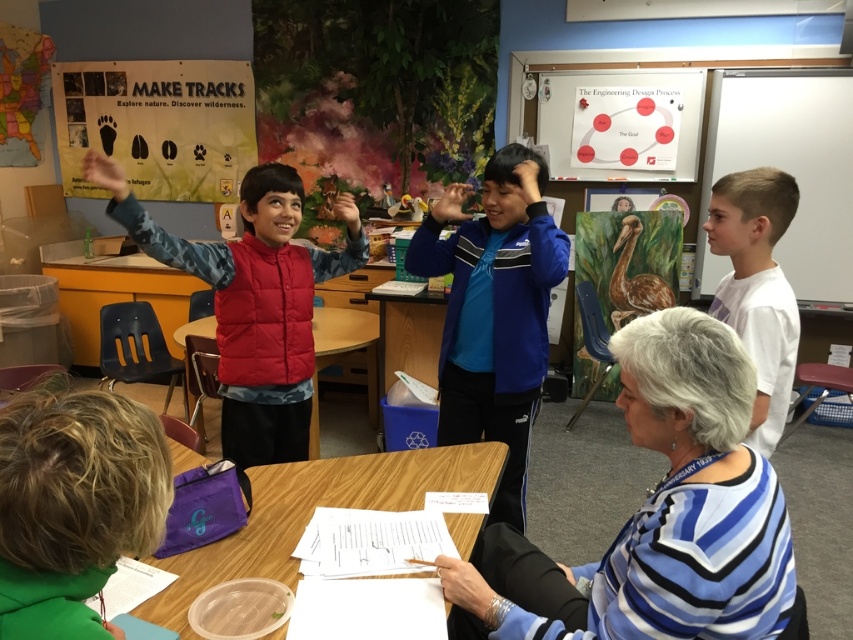
Is purple fabric table at lower center taller than smooth skin hand at center?

Yes, purple fabric table at lower center is taller than smooth skin hand at center.

Does purple fabric table at lower center appear over smooth skin hand at center?

Correct, purple fabric table at lower center is located above smooth skin hand at center.

Which is in front, point (306, 477) or point (439, 556)?

Point (439, 556) is in front.

This screenshot has height=640, width=853. In order to click on purple fabric table at lower center in this screenshot , I will do tap(311, 513).

Which is more to the left, green fabric at lower left or wooden table at center?

wooden table at center is more to the left.

Which is below, green fabric at lower left or wooden table at center?

Positioned lower is wooden table at center.

Which is in front, point (115, 417) or point (194, 326)?

Point (115, 417) is more forward.

Locate an element on the screen. This screenshot has width=853, height=640. green fabric at lower left is located at coordinates (74, 506).

Can you confirm if blue striped shirt at lower right is shorter than white matte shirt at right?

Correct, blue striped shirt at lower right is not as tall as white matte shirt at right.

Is blue striped shirt at lower right to the left of white matte shirt at right from the viewer's perspective?

Yes, blue striped shirt at lower right is to the left of white matte shirt at right.

Does point (630, 637) come behind point (727, 298)?

No, (630, 637) is in front of (727, 298).

The image size is (853, 640). What are the coordinates of `blue striped shirt at lower right` in the screenshot? It's located at (666, 513).